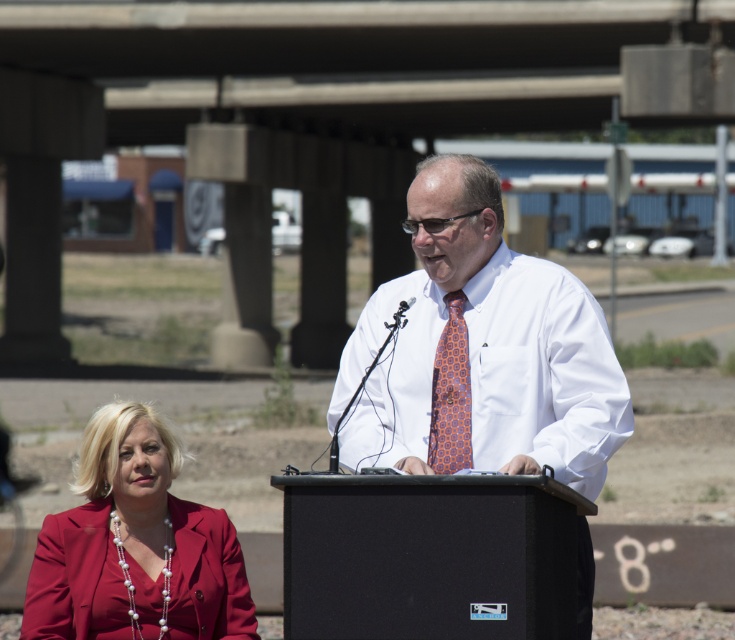
Describe the element at coordinates (429, 556) in the screenshot. The image size is (735, 640). I see `black plastic speaker at center` at that location.

Can you confirm if black plastic speaker at center is wider than matte red blazer at lower left?

Yes.

At what (x,y) coordinates should I click in order to perform the action: click on black plastic speaker at center. Please return your answer as a coordinate pair (x, y). The width and height of the screenshot is (735, 640). Looking at the image, I should click on (429, 556).

Where is `black plastic speaker at center`? This screenshot has height=640, width=735. black plastic speaker at center is located at coordinates (429, 556).

Which is in front, point (381, 125) or point (492, 358)?

Positioned in front is point (492, 358).

Image resolution: width=735 pixels, height=640 pixels. In order to click on concrete at center in this screenshot , I will do `click(315, 118)`.

Is black plastic speaker at center further to camera compared to white woven dress shirt at center?

No, it is in front of white woven dress shirt at center.

Describe the element at coordinates (429, 556) in the screenshot. I see `black plastic speaker at center` at that location.

Which is behind, point (498, 497) or point (595, 397)?

The point (595, 397) is more distant.

This screenshot has height=640, width=735. Find the location of `black plastic speaker at center`. black plastic speaker at center is located at coordinates coord(429,556).